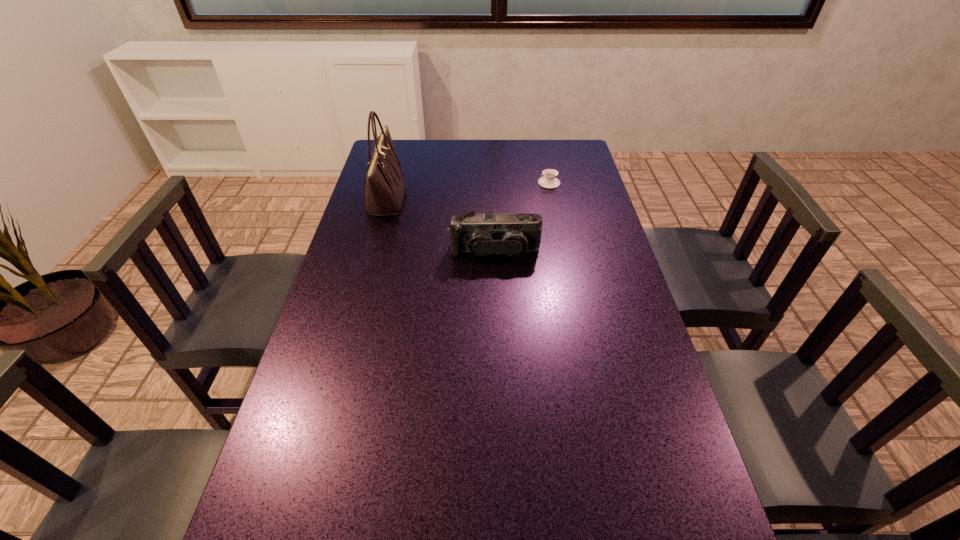
Where is `the leftmost object`? This screenshot has width=960, height=540. the leftmost object is located at coordinates (384, 191).

You are a GUI agent. You are given a task and a screenshot of the screen. Output one action in this format:
    pyautogui.click(x=<x>, y=<y>)
    Task: Click on the tallest object
    This screenshot has height=540, width=960.
    Given the screenshot: What is the action you would take?
    pyautogui.click(x=384, y=191)

This screenshot has height=540, width=960. In order to click on the second shortest object in this screenshot , I will do `click(512, 234)`.

Identify the location of camcorder. Image resolution: width=960 pixels, height=540 pixels. (512, 234).

The height and width of the screenshot is (540, 960). I want to click on the shortest object, so click(x=548, y=181).

Where is `teacup`? This screenshot has width=960, height=540. teacup is located at coordinates (548, 181).

Locate an element on the screen. free spot located 0.380m on the front-facing side of the tallest object is located at coordinates (511, 199).

At what (x,y) coordinates should I click in order to perform the action: click on free space located on the front-facing side of the nearest object. Please return your answer as a coordinate pair (x, y). This screenshot has width=960, height=540. Looking at the image, I should click on (498, 341).

Where is `free space located on the handle side of the teacup`? The image size is (960, 540). free space located on the handle side of the teacup is located at coordinates (514, 183).

The height and width of the screenshot is (540, 960). What are the coordinates of `vacant space located on the handle side of the teacup` in the screenshot? It's located at 440,183.